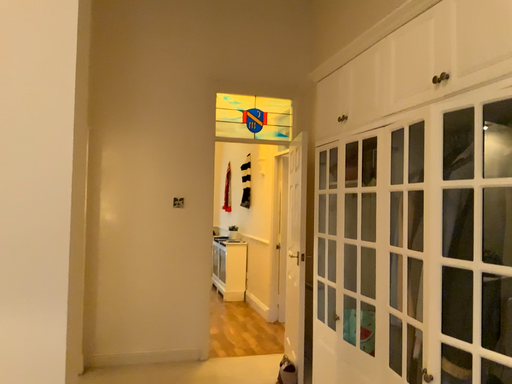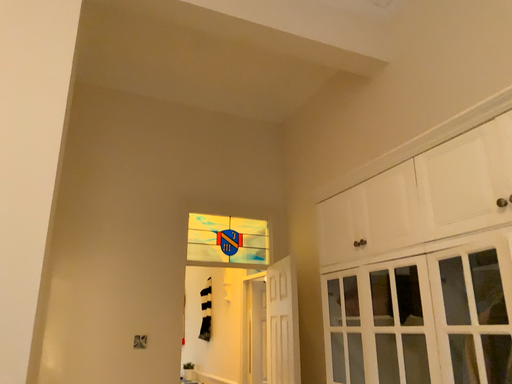
Question: Which way did the camera rotate in the video?

Choices:
 (A) rotated left
 (B) rotated right

Answer: (B)